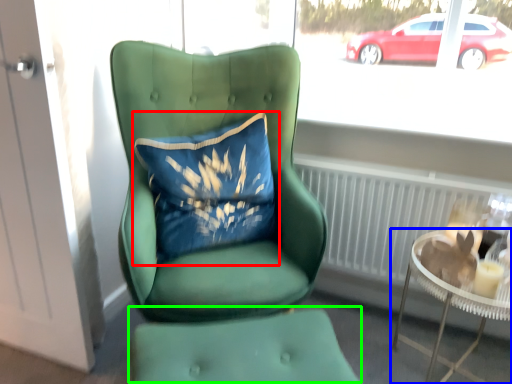
Question: Which object is positioned farthest from pillow (highlighted by a red box)? Select from table (highlighted by a blue box) and footrest (highlighted by a green box).

Choices:
 (A) table
 (B) footrest

Answer: (A)